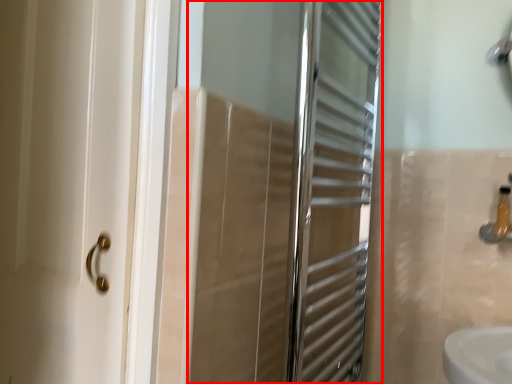
Question: From the image, what is the correct spatial relationship of screen door (annotated by the red box) in relation to toiletry?

Choices:
 (A) left
 (B) right

Answer: (A)